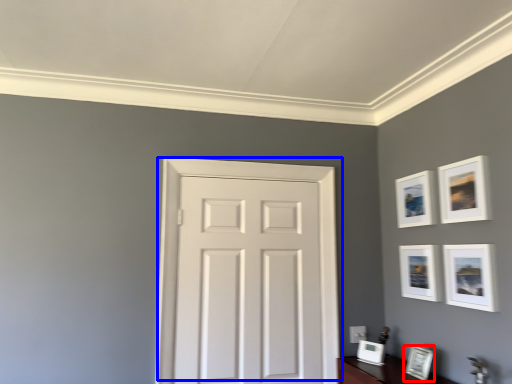
Question: Which object is further to the camera taking this photo, picture frame (highlighted by a red box) or door (highlighted by a blue box)?

Choices:
 (A) picture frame
 (B) door

Answer: (B)